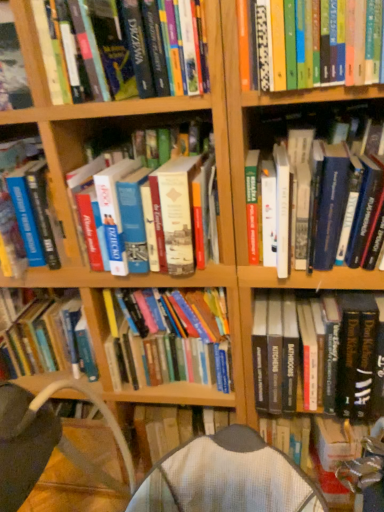
Question: In terms of height, does hardcover book at lower right, the 1th book positioned from the right, look taller or shorter compared to hardcover book at upper right, which is the third book in right-to-left order?

Choices:
 (A) tall
 (B) short

Answer: (A)

Question: Is hardcover book at lower right, acting as the seventh book starting from the left, spatially inside hardcover book at upper right, which appears as the 5th book when viewed from the left, or outside of it?

Choices:
 (A) inside
 (B) outside

Answer: (B)

Question: Based on their relative distances, which object is farther from the hardcover book at upper left, which ranks as the second book in left-to-right order?

Choices:
 (A) hardcover book at center, arranged as the 4th book when viewed from the right
 (B) hardcover book at upper right, which is the third book in right-to-left order
 (C) hardcover book at lower right, the 1th book positioned from the right
 (D) hardcover book at left, the seventh book from the right
 (E) hardcover book at center, which appears as the 2th book when viewed from the right

Answer: (C)

Question: Estimate the real-world distances between objects in this image. Which object is farther from the hardcover book at center, which appears as the 2th book when viewed from the right?

Choices:
 (A) hardcover book at lower right, the 1th book positioned from the right
 (B) hardcover book at upper right, which appears as the 5th book when viewed from the left
 (C) hardcover book at upper left, which ranks as the second book in left-to-right order
 (D) hardcover book at left, the seventh book from the right
 (E) hardcover book at center, arranged as the 4th book when viewed from the right

Answer: (D)